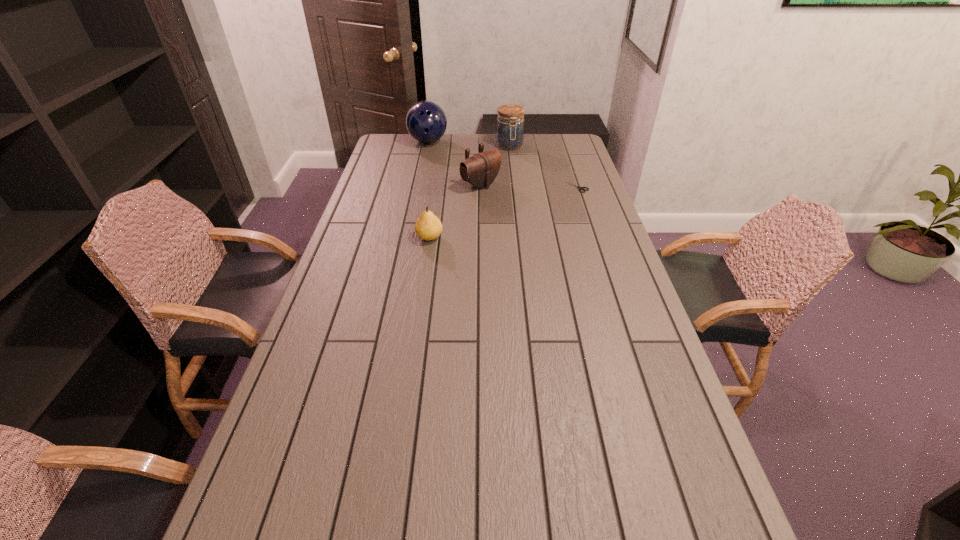
This screenshot has height=540, width=960. In order to click on vacant point that satisfies the following two spatial constraints: 1. on the back side of the shears; 2. on the left side of the nearest object in this screenshot , I will do `click(437, 186)`.